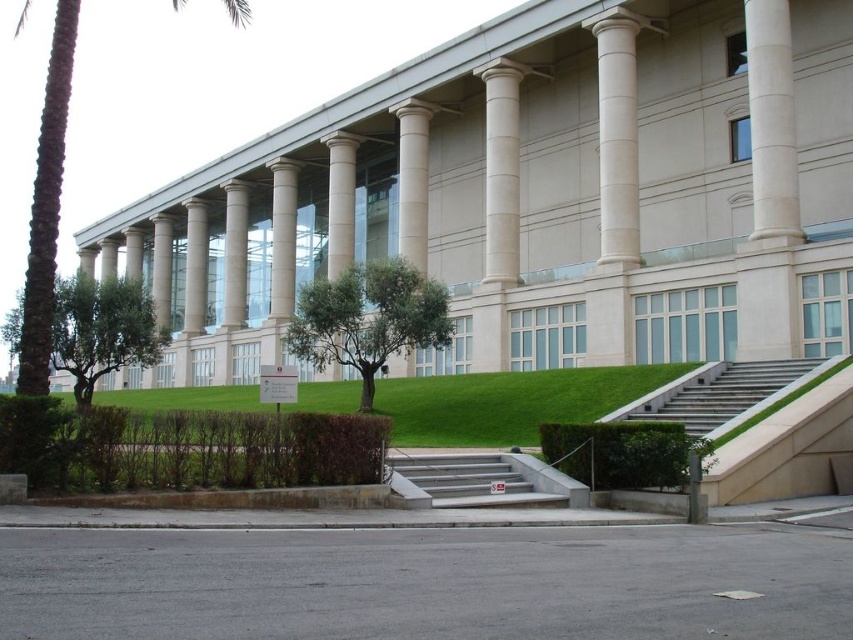
You are standing in front of the building and want to take a photo of the white marble pillar at center without the green leafy tree at center blocking it. Which direction should you move to ensure the pillar is visible?

The green leafy tree at center is in front of the white marble pillar at center. To take a photo of the white marble pillar at center without the tree blocking it, you should move to a position where the pillar is not obscured by the tree. Since the tree is in front of the pillar, moving to the side either to the left or right of the current position would allow you to see around the tree and capture the pillar clearly.

You are standing on the lawn in front of the building and want to reach the entrance. Which object, the green concrete stairs at lower right or the white marble pillar at center, is closer to you?

The green concrete stairs at lower right is closer to the viewer than the white marble pillar at center, so the stairs are closer to you.